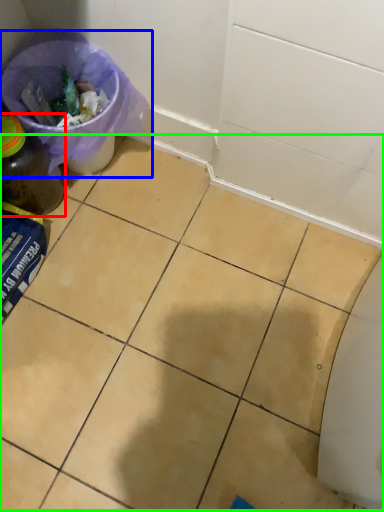
Question: Estimate the real-world distances between objects in this image. Which object is farther from bottle (highlighted by a red box), recycling bin (highlighted by a blue box) or ceramic tile (highlighted by a green box)?

Choices:
 (A) recycling bin
 (B) ceramic tile

Answer: (B)